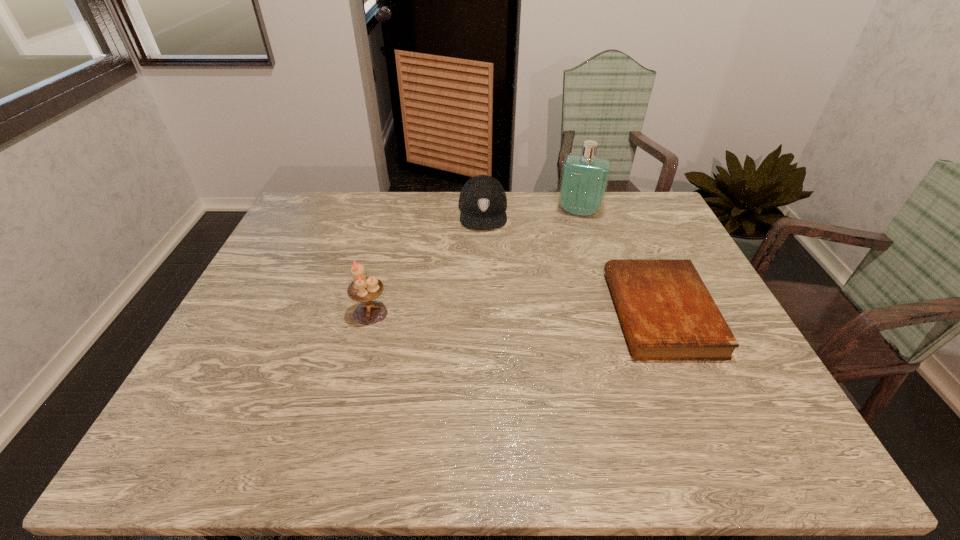
The image size is (960, 540). Find the location of `vacant space that is in between the third object from right to left and the candle holder`. vacant space that is in between the third object from right to left and the candle holder is located at coordinates (427, 262).

The width and height of the screenshot is (960, 540). What are the coordinates of `unoccupied position between the second tallest object and the shortest object` in the screenshot? It's located at (516, 313).

Locate an element on the screen. vacant point located between the perfume and the third object from right to left is located at coordinates (531, 212).

Locate which object is the second closest to the leftmost object. Please provide its 2D coordinates. Your answer should be formatted as a tuple, i.e. [(x, y)], where the tuple contains the x and y coordinates of a point satisfying the conditions above.

[(667, 313)]

The image size is (960, 540). Identify the location of object identified as the third closest to the Bible. (364, 289).

Locate an element on the screen. Image resolution: width=960 pixels, height=540 pixels. vacant area that satisfies the following two spatial constraints: 1. on the back side of the candle holder; 2. on the spine side of the shortest object is located at coordinates (371, 313).